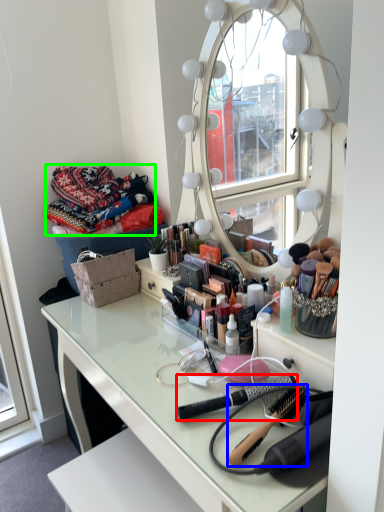
Question: Which object is the closest to the brush (highlighted by a red box)? Choose among these: brush (highlighted by a blue box) or material (highlighted by a green box).

Choices:
 (A) brush
 (B) material

Answer: (A)